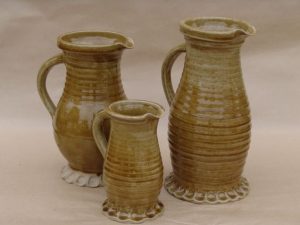
Where is `medium pitcher handle`? medium pitcher handle is located at coordinates (39, 80).